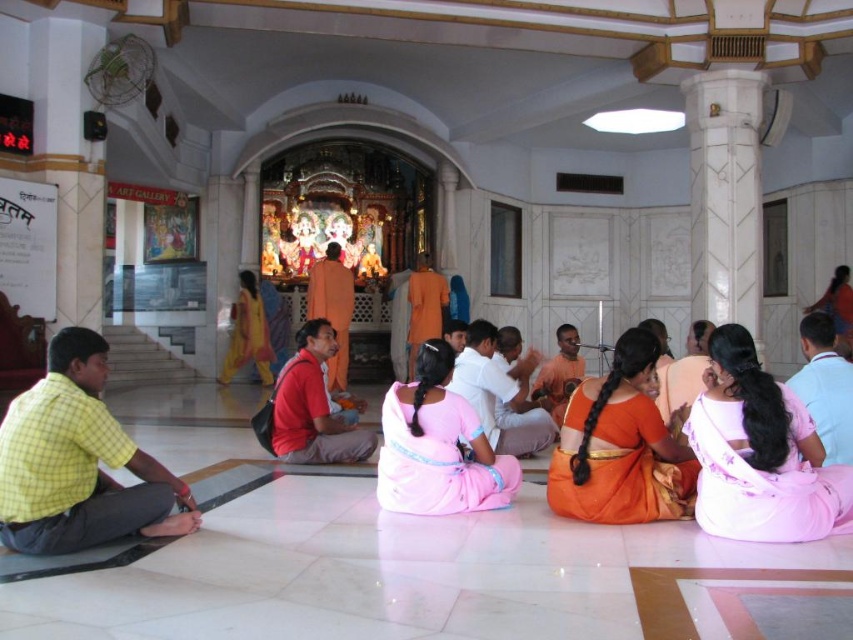
Can you confirm if pink silk saree at lower right is positioned below orange silk saree at center?

Actually, pink silk saree at lower right is above orange silk saree at center.

Which is in front, point (758, 499) or point (564, 420)?

Positioned in front is point (758, 499).

Find the location of a particular element. pink silk saree at lower right is located at coordinates (763, 477).

Locate an element on the screen. The height and width of the screenshot is (640, 853). pink silk saree at lower right is located at coordinates (763, 477).

Can you confirm if pink silk saree at lower right is positioned below white cotton shirt at center?

Correct, pink silk saree at lower right is located below white cotton shirt at center.

Who is more forward, (686, 419) or (532, 360)?

Point (686, 419)

The height and width of the screenshot is (640, 853). Find the location of `pink silk saree at lower right`. pink silk saree at lower right is located at coordinates (763, 477).

Does pink silk saree at lower right have a lesser width compared to orange clothed man at center?

Correct, pink silk saree at lower right's width is less than orange clothed man at center's.

Consider the image. Between pink silk saree at lower right and orange clothed man at center, which one is positioned lower?

pink silk saree at lower right is lower down.

Does point (747, 470) come in front of point (543, 387)?

That is True.

Identify the location of pink silk saree at lower right. This screenshot has width=853, height=640. (763, 477).